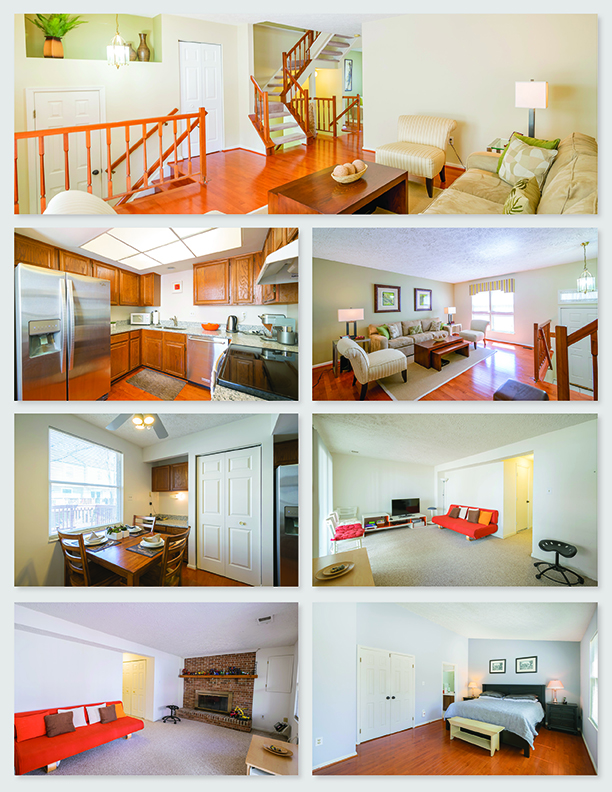
Where is `doors`? The image size is (612, 792). doors is located at coordinates (135, 688), (234, 505), (526, 505), (397, 691), (378, 693), (204, 78), (73, 109).